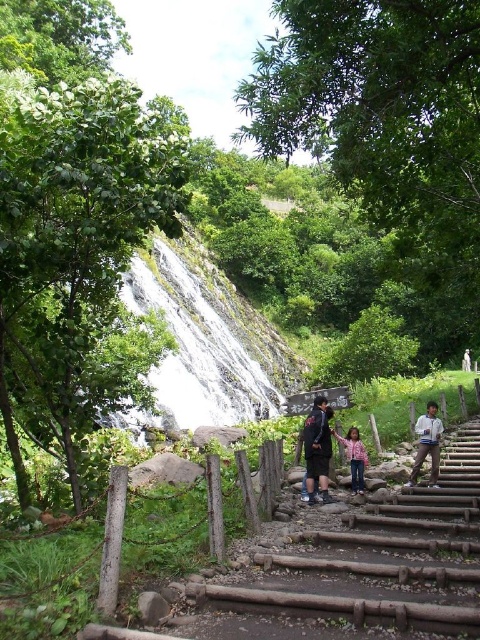
Is point (309, 470) positioned after point (352, 468)?

No, (309, 470) is closer to viewer.

Which is below, dark blue fabric jacket at center or pink cotton shirt at center?

pink cotton shirt at center

Where is `dark blue fabric jacket at center`? dark blue fabric jacket at center is located at coordinates (316, 449).

Between point (252, 396) and point (315, 464), which one is positioned behind?

Positioned behind is point (252, 396).

Is point (192, 344) in front of point (305, 445)?

No, (192, 344) is behind (305, 445).

Which is in front, point (277, 337) or point (313, 413)?

Point (313, 413) is more forward.

Identify the location of white textured waterfall at center. The image size is (480, 640). (199, 346).

Who is higher up, white textured waterfall at center or white cotton jacket at lower right?

white textured waterfall at center

Is white textured waterfall at center to the left of white cotton jacket at lower right from the viewer's perspective?

Yes, white textured waterfall at center is to the left of white cotton jacket at lower right.

Which is in front, point (168, 301) or point (429, 417)?

Positioned in front is point (429, 417).

I want to click on white textured waterfall at center, so click(x=199, y=346).